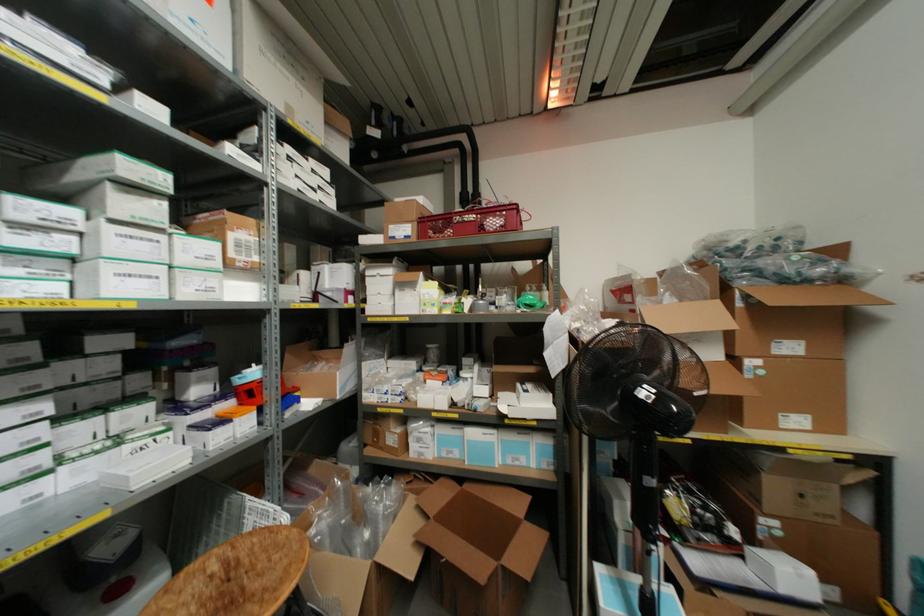
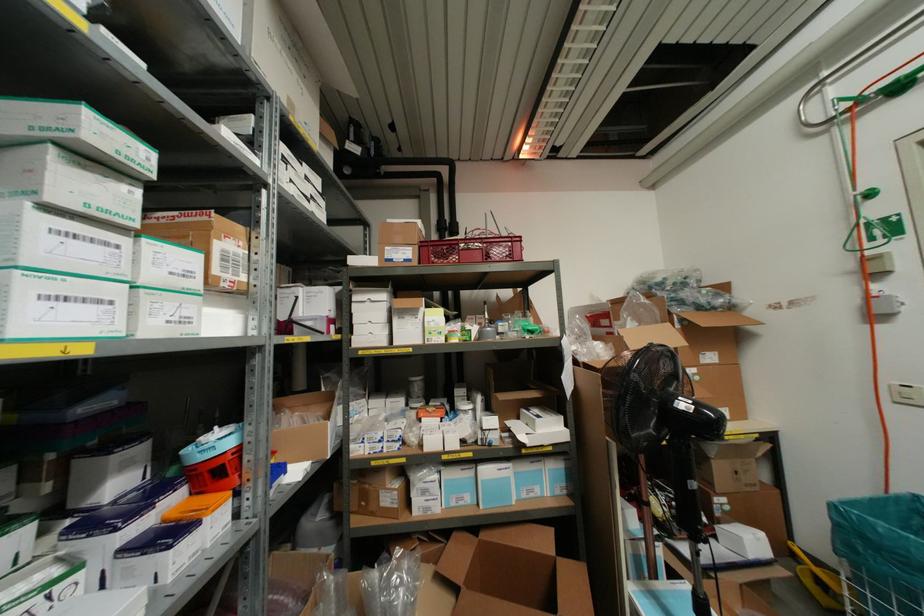
In the second image, find the point that corresponds to point 368,273 in the first image.

(354, 298)